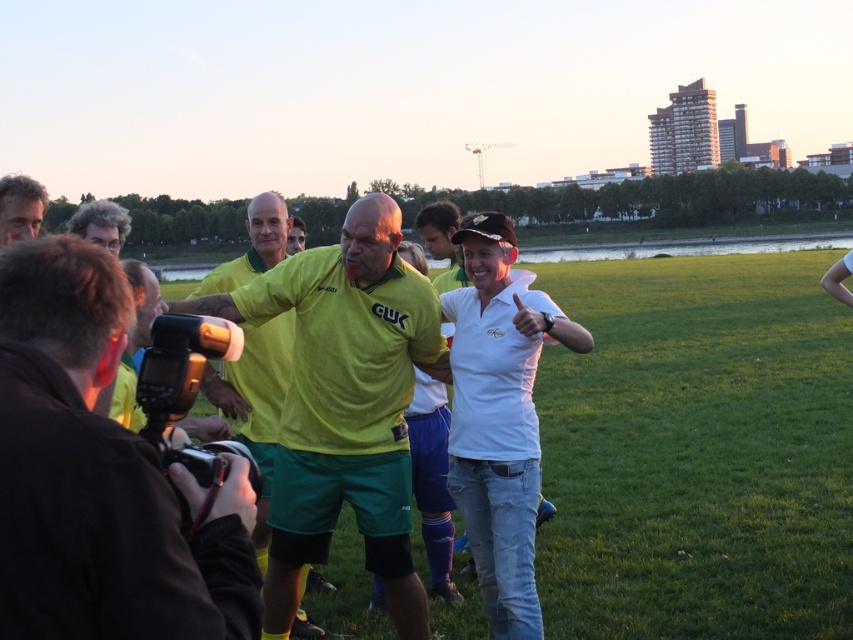
Question: From the image, what is the correct spatial relationship of matte green shorts at center in relation to curly hair at upper left?

Choices:
 (A) below
 (B) above

Answer: (A)

Question: Which of the following is the closest to the observer?

Choices:
 (A) yellow matte shirt at center
 (B) curly hair at left
 (C) matte green shorts at center

Answer: (B)

Question: Which of the following is the farthest from the observer?

Choices:
 (A) (339, 396)
 (B) (102, 608)
 (C) (38, 212)
 (D) (303, 224)

Answer: (D)

Question: Does curly hair at left lie behind curly hair at upper left?

Choices:
 (A) yes
 (B) no

Answer: (A)

Question: Which object is farther from the camera taking this photo?

Choices:
 (A) curly hair at left
 (B) curly hair at upper left
 (C) yellow matte shirt at center
 (D) yellow-green jersey at center

Answer: (C)

Question: Is matte green shorts at center thinner than yellow matte shirt at center?

Choices:
 (A) yes
 (B) no

Answer: (A)